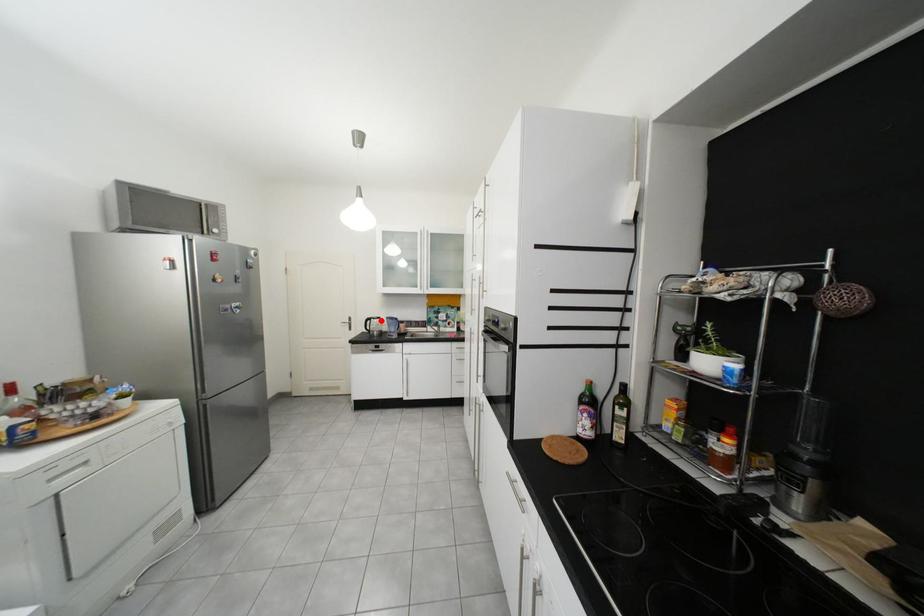
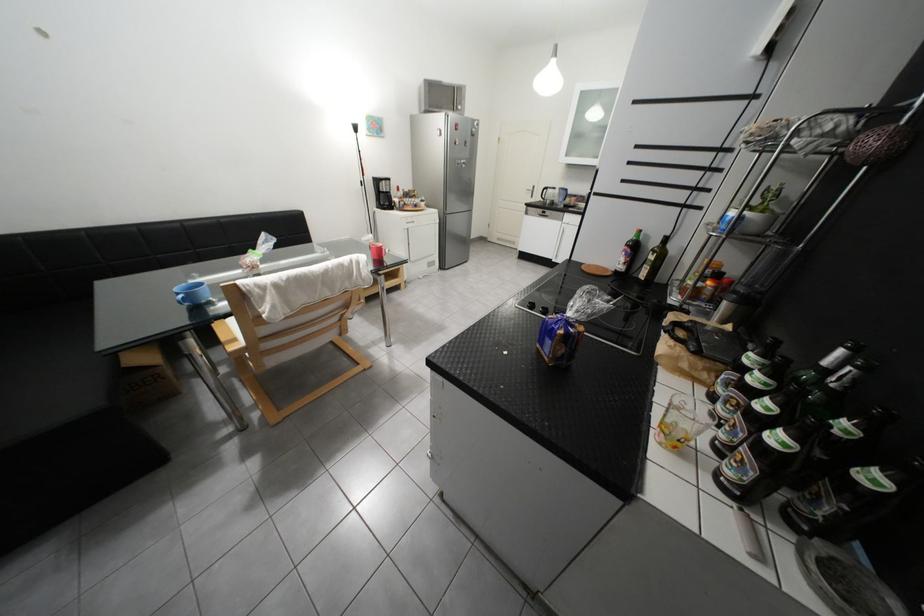
Question: I am providing you with two images of the same scene from different viewpoints. Given a red point in image1, look at the same physical point in image2. Is it:

Choices:
 (A) Closer to the viewpoint
 (B) Farther from the viewpoint

Answer: (A)